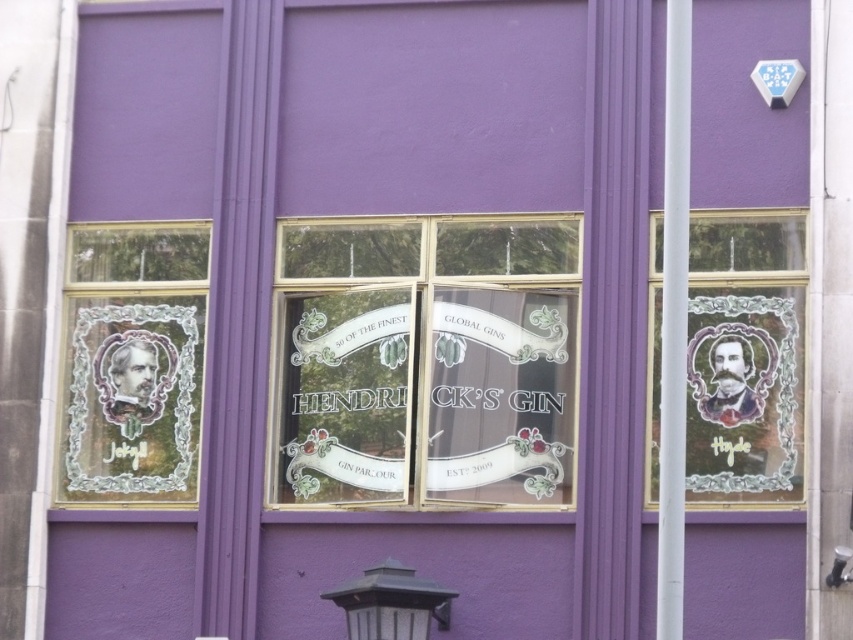
Can you confirm if clear glass hendrick's gin sign at center is smaller than translucent glass portrait at right?

No.

Does clear glass hendrick's gin sign at center have a greater height compared to translucent glass portrait at right?

Correct, clear glass hendrick's gin sign at center is much taller as translucent glass portrait at right.

What do you see at coordinates (425, 362) in the screenshot? I see `clear glass hendrick's gin sign at center` at bounding box center [425, 362].

This screenshot has height=640, width=853. In order to click on clear glass hendrick's gin sign at center in this screenshot , I will do tap(425, 362).

Does clear glass hendrick's gin sign at center appear on the right side of matte glass portrait at left?

Correct, you'll find clear glass hendrick's gin sign at center to the right of matte glass portrait at left.

Can you confirm if clear glass hendrick's gin sign at center is bigger than matte glass portrait at left?

Correct, clear glass hendrick's gin sign at center is larger in size than matte glass portrait at left.

Who is more distant from viewer, (x=285, y=449) or (x=144, y=298)?

The point (x=144, y=298) is more distant.

The height and width of the screenshot is (640, 853). I want to click on clear glass hendrick's gin sign at center, so click(425, 362).

Is point (170, 262) positioned after point (392, 576)?

Yes.

I want to click on matte glass portrait at left, so click(x=132, y=364).